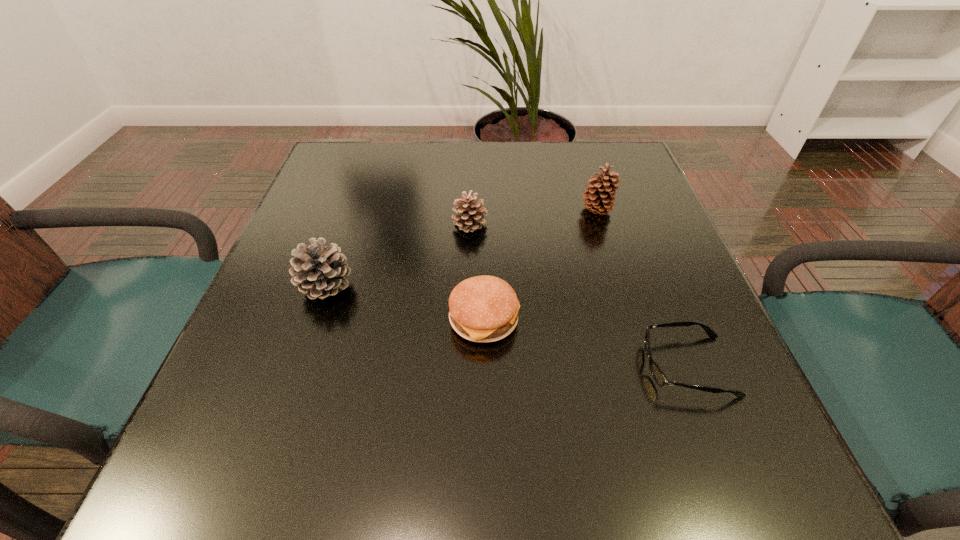
Identify the location of empty space that is in between the rightmost pinecone and the shortest pinecone. (533, 218).

The width and height of the screenshot is (960, 540). I want to click on object that is the fourth closest one to the shortest object, so click(x=319, y=271).

Identify the location of the third closest object to the second pinecone from right to left. (599, 199).

Choose which pinecone is the nearest neighbor to the rightmost pinecone. Please provide its 2D coordinates. Your answer should be formatted as a tuple, i.e. [(x, y)], where the tuple contains the x and y coordinates of a point satisfying the conditions above.

[(470, 217)]

Choose which pinecone is the nearest neighbor to the hamburger. Please provide its 2D coordinates. Your answer should be formatted as a tuple, i.e. [(x, y)], where the tuple contains the x and y coordinates of a point satisfying the conditions above.

[(470, 217)]

Find the location of `free location that satisfies the following two spatial constraints: 1. on the front side of the hamburger; 2. on the left side of the second pinecone from right to left`. free location that satisfies the following two spatial constraints: 1. on the front side of the hamburger; 2. on the left side of the second pinecone from right to left is located at coordinates (468, 320).